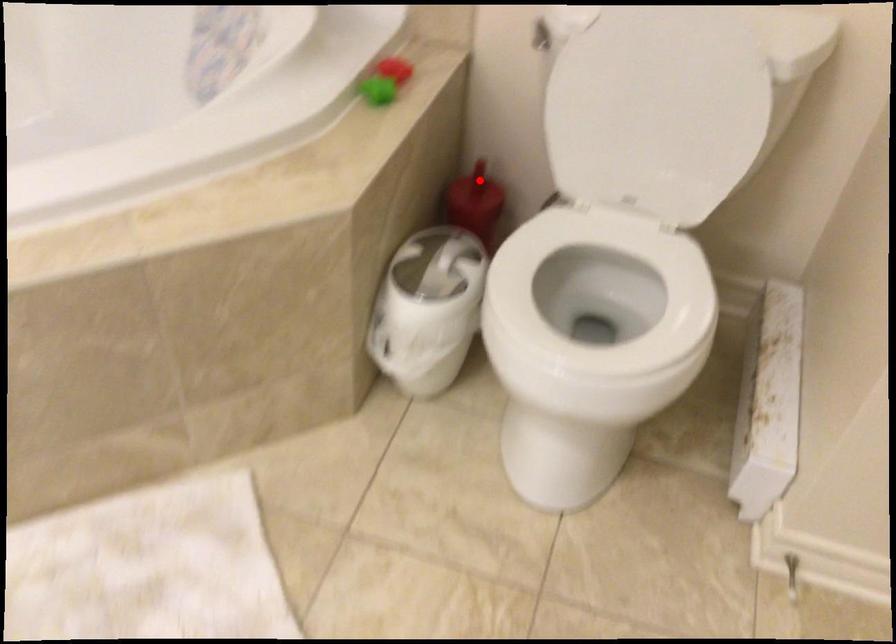
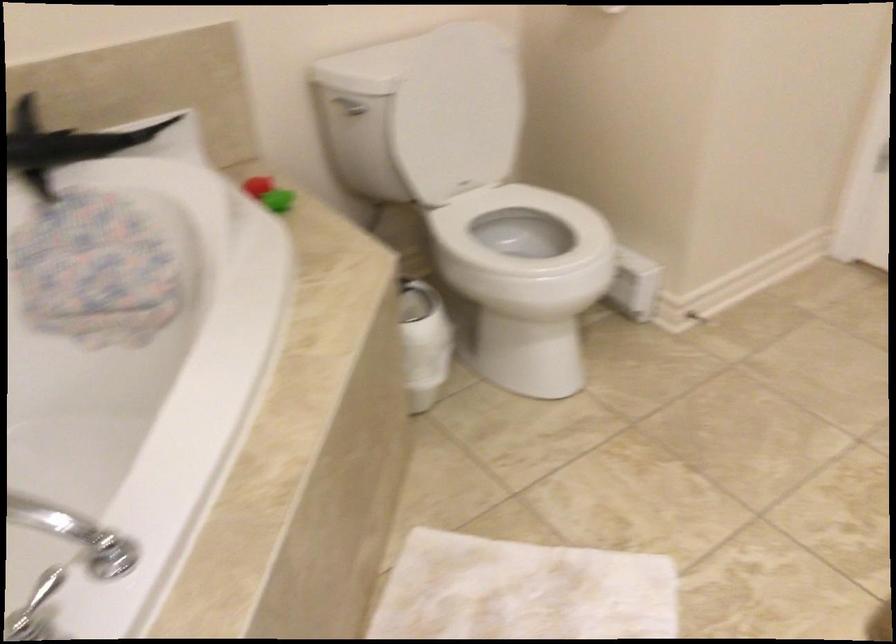
Question: I am providing you with two images of the same scene from different viewpoints. A red point is marked on the first image. At the location where the point appears in image 1, is it still visible in image 2?

Choices:
 (A) Yes
 (B) No

Answer: (B)